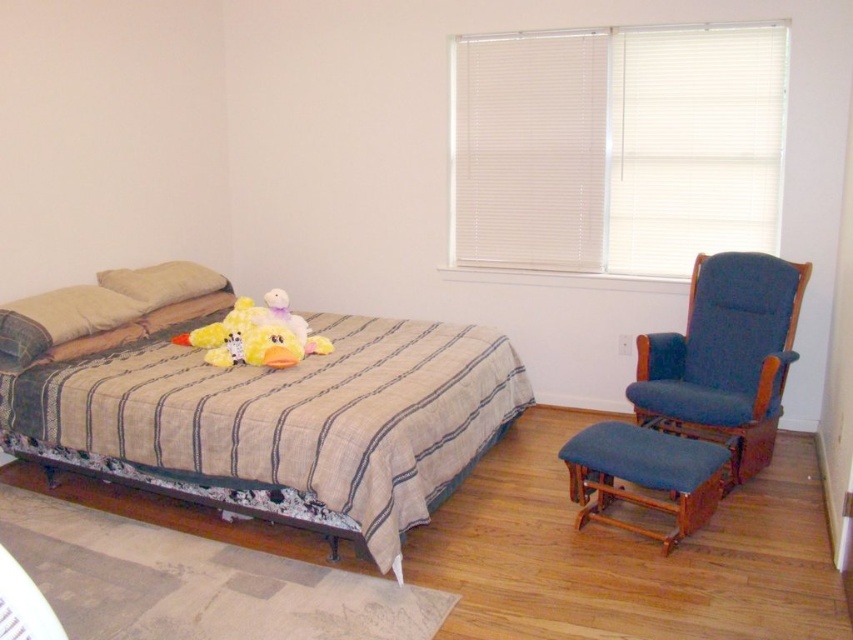
Is striped fabric bed at left behind blue fabric stool at lower right?

No, it is in front of blue fabric stool at lower right.

Which is in front, point (440, 326) or point (608, 454)?

Positioned in front is point (608, 454).

This screenshot has height=640, width=853. Identify the location of striped fabric bed at left. (276, 413).

Is blue fabric rocking chair at right behind beige fabric pillow at left?

No, it is in front of beige fabric pillow at left.

Does point (640, 412) lie in front of point (123, 321)?

That is True.

In order to click on blue fabric rocking chair at right in this screenshot , I will do `click(724, 356)`.

Is point (650, 465) more distant than point (3, 328)?

No, it is not.

Between point (705, 465) and point (119, 316), which one is positioned in front?

Point (705, 465) is more forward.

Which is behind, point (666, 433) or point (119, 317)?

The point (119, 317) is behind.

This screenshot has width=853, height=640. I want to click on blue fabric stool at lower right, so click(x=643, y=474).